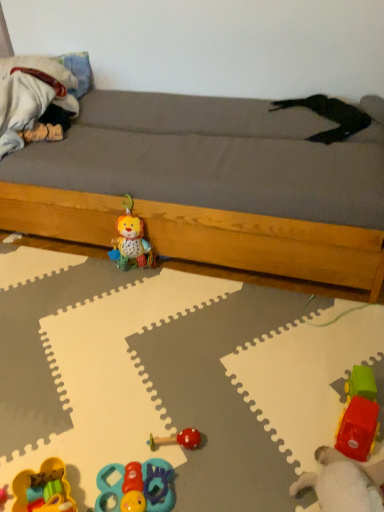
Question: Is rubberized plastic car at lower right, the second toy from the right, taller or shorter than rubberized blue and red toy at lower center, which appears as the third toy when viewed from the left?

Choices:
 (A) tall
 (B) short

Answer: (A)

Question: Which is correct: rubberized plastic car at lower right, the fifth toy when ordered from left to right, is inside rubberized blue and red toy at lower center, which appears as the third toy when viewed from the left, or outside of it?

Choices:
 (A) outside
 (B) inside

Answer: (A)

Question: Which of these objects is positioned farthest from the plush fabric lion at center, the 2th toy when ordered from left to right?

Choices:
 (A) smooth plastic rattle at center, the 3th toy viewed from the right
 (B) rubberized blue and red toy at lower center, which appears as the third toy when viewed from the left
 (C) rubberized yellow toy at lower left, marked as the first toy in a left-to-right arrangement
 (D) rubberized plastic car at lower right, the second toy from the right
 (E) fluffy white blanket at left

Answer: (D)

Question: Estimate the real-world distances between objects in this image. Which object is farther from the wooden bed frame at center?

Choices:
 (A) fluffy white blanket at left
 (B) plush fabric lion at center, the 2th toy when ordered from left to right
 (C) rubberized plastic truck at lower right, marked as the 1th toy in a right-to-left arrangement
 (D) rubberized blue and red toy at lower center, which appears as the third toy when viewed from the left
 (E) smooth plastic rattle at center, the 3th toy viewed from the right

Answer: (D)